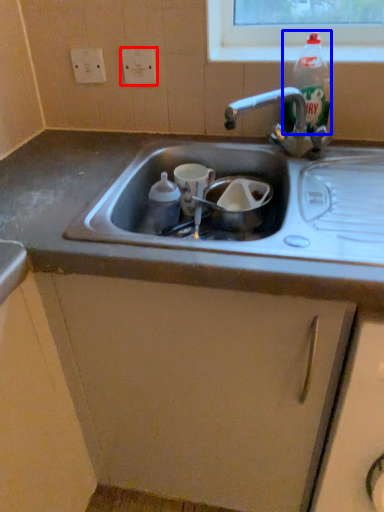
Question: Which of the following is the farthest to the observer, electric outlet (highlighted by a red box) or bottle (highlighted by a blue box)?

Choices:
 (A) electric outlet
 (B) bottle

Answer: (A)